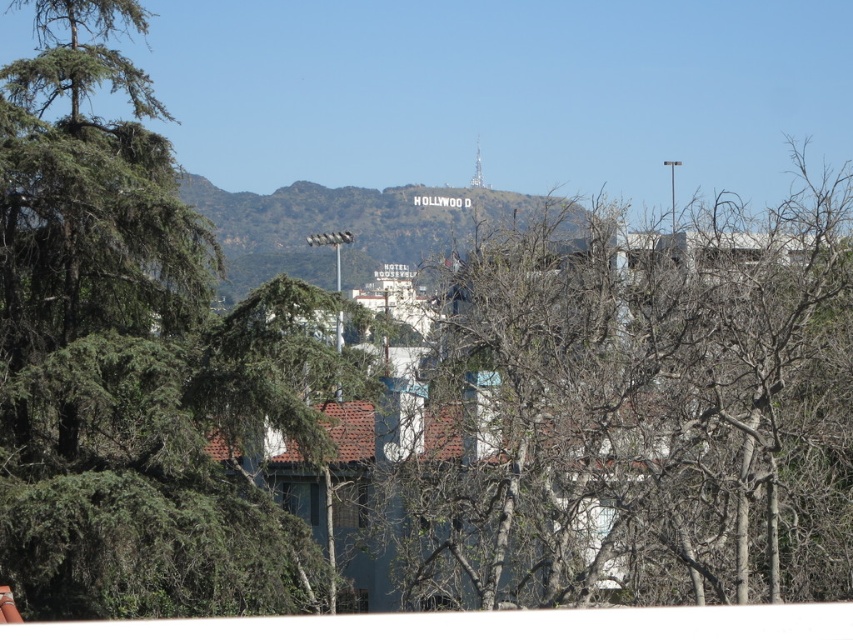
You are standing at the base of the hill looking up at the Hollywood sign. You notice a green leafy tree at left and the white stone Hollywood sign at center. Which object is nearer to you?

The green leafy tree at left is closer to the viewer than the white stone Hollywood sign at center.

You are a photographer planning to capture the Hollywood sign against the sky. You notice the bare branches at center and the white stone Hollywood sign at center. Which object will block the view of the sky more when positioned in front?

The bare branches at center is much taller than the white stone Hollywood sign at center, so it will block the view of the sky more when positioned in front.

You are a photographer planning to take a picture of the Hollywood sign. You notice the bare branches at center and the green leafy tree at left in your frame. Which tree should you position closer to the Hollywood sign to ensure it appears larger in your photo?

The bare branches at center is bigger than the green leafy tree at left, so positioning the bare branches at center closer to the Hollywood sign will make it appear larger in the photo.